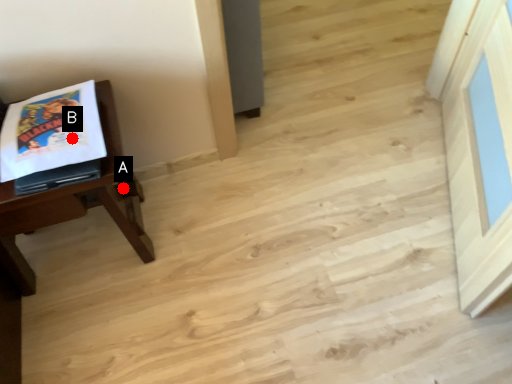
Question: Two points are circled on the image, labeled by A and B beside each circle. Which point is closer to the camera taking this photo?

Choices:
 (A) A is closer
 (B) B is closer

Answer: (B)